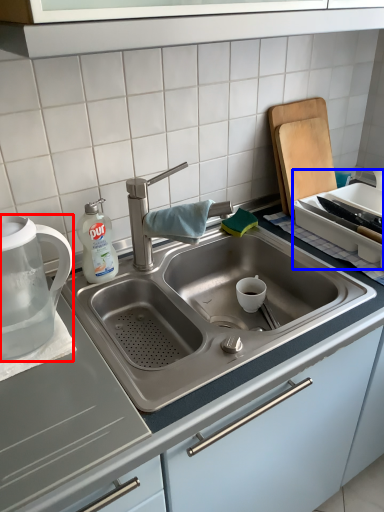
Question: Among these objects, which one is nearest to the camera, tea pot (highlighted by a red box) or appliance (highlighted by a blue box)?

Choices:
 (A) tea pot
 (B) appliance

Answer: (A)